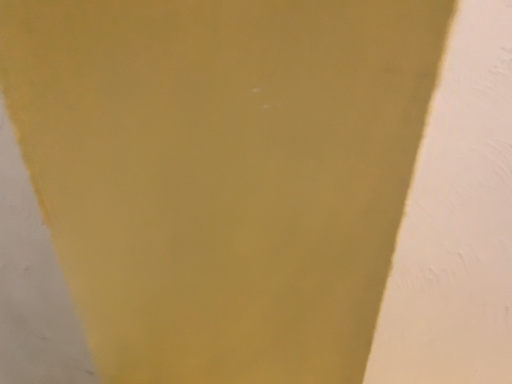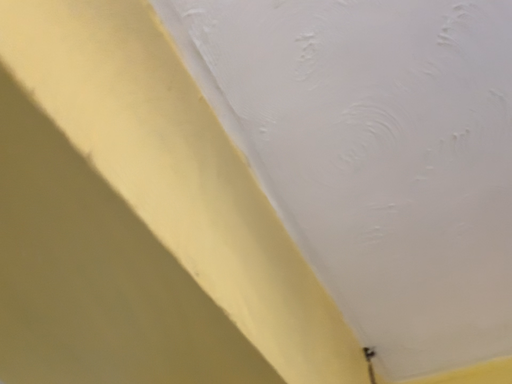
Question: Which way did the camera rotate in the video?

Choices:
 (A) rotated right
 (B) rotated left

Answer: (B)